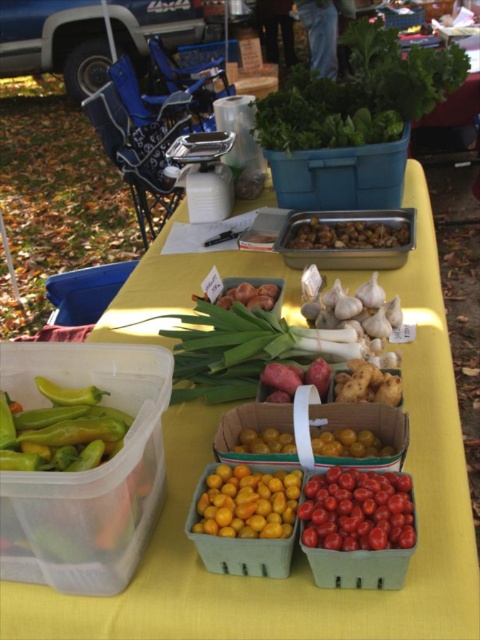
Who is lower down, brown matte nuts at center or yellow matte cherry tomatoes at center?

yellow matte cherry tomatoes at center is lower down.

Who is more forward, (379, 221) or (385, 451)?

Point (385, 451) is more forward.

Is point (379, 228) positioned in front of point (359, 444)?

No, (379, 228) is further to viewer.

Locate an element on the screen. The image size is (480, 640). brown matte nuts at center is located at coordinates (348, 234).

At what (x,y) coordinates should I click in order to perform the action: click on yellow matte tomatoes at center. Please return your answer as a coordinate pair (x, y). This screenshot has width=480, height=640. Looking at the image, I should click on (248, 502).

Who is more distant from viewer, (249, 467) or (256, 440)?

The point (256, 440) is more distant.

Find the location of a particular element. The width and height of the screenshot is (480, 640). yellow matte tomatoes at center is located at coordinates (248, 502).

Which is above, green matte peppers at center-left or green leafy at upper center?

green leafy at upper center is higher up.

Which is in front, point (109, 412) or point (442, 67)?

Point (109, 412) is in front.

Locate an element on the screen. The image size is (480, 640). green matte peppers at center-left is located at coordinates (80, 476).